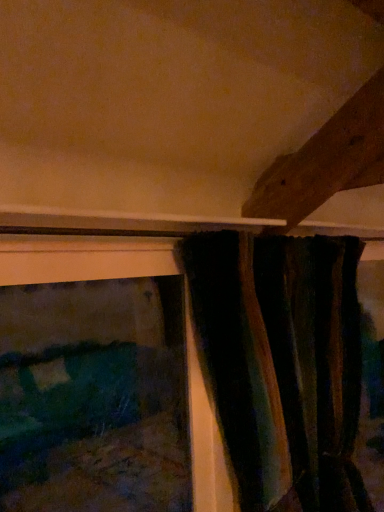
Identify the location of velvet dark at upper center. This screenshot has width=384, height=512. (283, 362).

Describe the element at coordinates (283, 362) in the screenshot. I see `velvet dark at upper center` at that location.

Where is `velvet dark at upper center`? velvet dark at upper center is located at coordinates (283, 362).